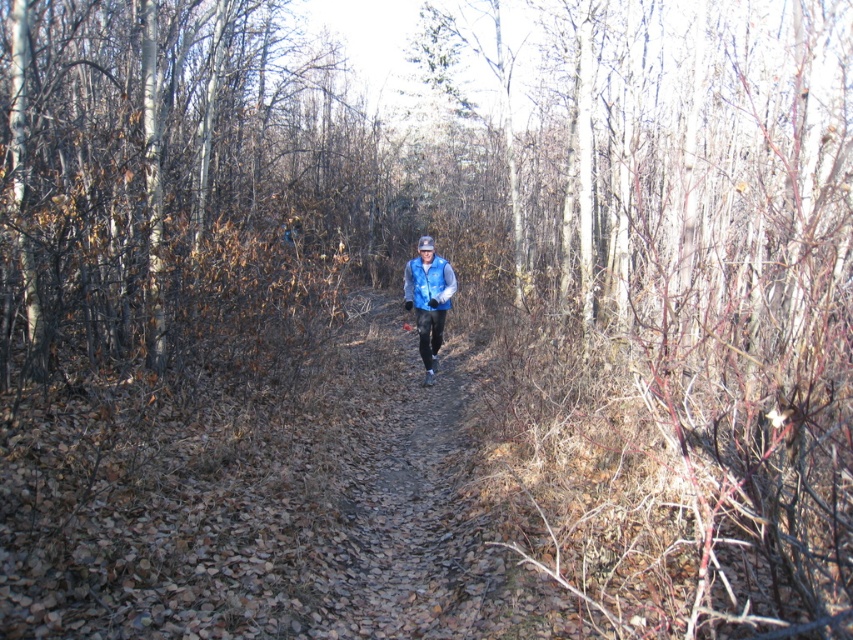
Question: Can you confirm if brown bark tree at left is positioned to the right of blue fleece vest at center?

Choices:
 (A) no
 (B) yes

Answer: (A)

Question: Which point is closer to the camera?

Choices:
 (A) (228, 330)
 (B) (419, 292)

Answer: (A)

Question: Is brown bark tree at left positioned behind blue fleece vest at center?

Choices:
 (A) no
 (B) yes

Answer: (A)

Question: Considering the relative positions of brown bark tree at left and blue fleece vest at center in the image provided, where is brown bark tree at left located with respect to blue fleece vest at center?

Choices:
 (A) above
 (B) below

Answer: (A)

Question: Which of the following is the farthest from the observer?

Choices:
 (A) (202, 161)
 (B) (438, 328)

Answer: (A)